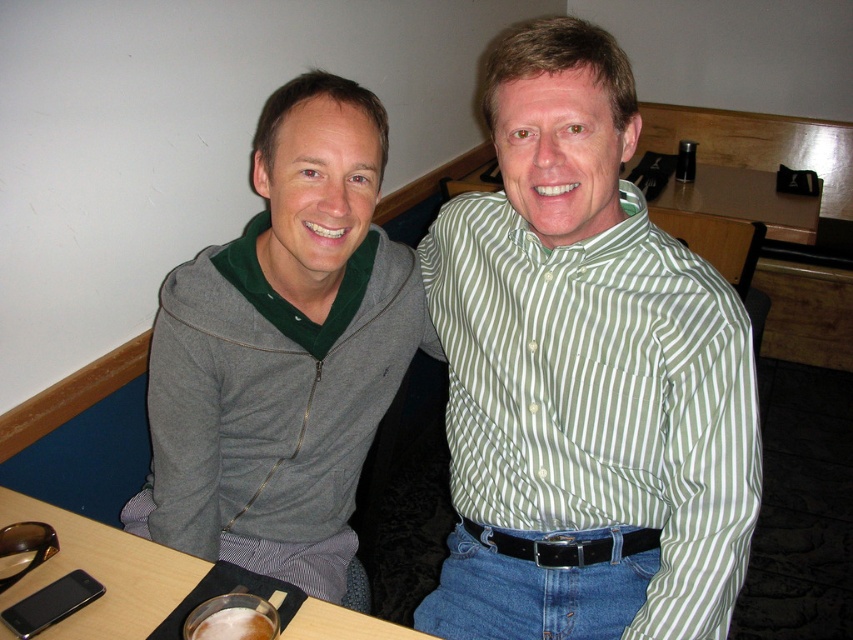
Is point (511, 513) less distant than point (260, 154)?

No, (511, 513) is further to viewer.

Can you confirm if green striped shirt at center is taller than gray zip-up hoodie at left?

Yes.

The height and width of the screenshot is (640, 853). What do you see at coordinates (584, 376) in the screenshot?
I see `green striped shirt at center` at bounding box center [584, 376].

Identify the location of green striped shirt at center. (584, 376).

What do you see at coordinates (584, 376) in the screenshot? I see `green striped shirt at center` at bounding box center [584, 376].

Between point (469, 273) and point (132, 566), which one is positioned in front?

Point (132, 566) is more forward.

This screenshot has height=640, width=853. In order to click on green striped shirt at center in this screenshot , I will do tap(584, 376).

Image resolution: width=853 pixels, height=640 pixels. What are the coordinates of `green striped shirt at center` in the screenshot? It's located at (584, 376).

Measure the distance between gray zip-up hoodie at left and black plastic phone at lower left.

11.03 inches

Who is shorter, gray zip-up hoodie at left or black plastic phone at lower left?

black plastic phone at lower left is shorter.

This screenshot has height=640, width=853. Find the location of `gray zip-up hoodie at left`. gray zip-up hoodie at left is located at coordinates (283, 353).

Locate an element on the screen. The width and height of the screenshot is (853, 640). gray zip-up hoodie at left is located at coordinates (283, 353).